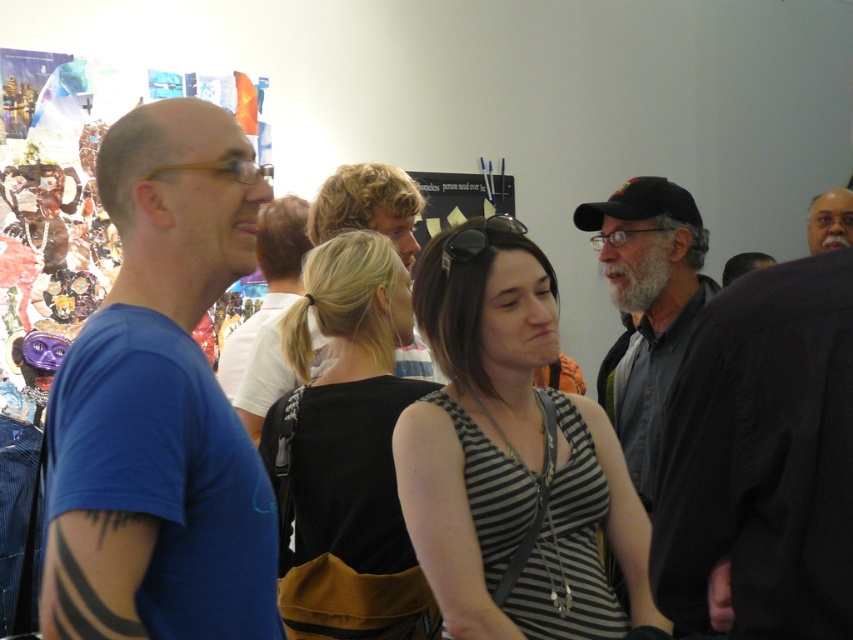
Question: Is black fabric at center positioned behind gray fabric shirt at center?

Choices:
 (A) no
 (B) yes

Answer: (A)

Question: Can you confirm if blue cotton t-shirt at left is positioned to the left of striped fabric tank top at center?

Choices:
 (A) no
 (B) yes

Answer: (B)

Question: Which object is positioned farthest from the gray hair at upper right?

Choices:
 (A) striped fabric tank top at center
 (B) gray fabric shirt at center
 (C) black fabric at center
 (D) blue cotton t-shirt at left

Answer: (D)

Question: Is striped fabric tank top at center in front of black fabric at center?

Choices:
 (A) yes
 (B) no

Answer: (A)

Question: Which point is closer to the camera taking this photo?

Choices:
 (A) (393, 291)
 (B) (666, 291)
 (C) (819, 221)
 (D) (491, 490)

Answer: (D)

Question: Which point is closer to the camera?

Choices:
 (A) gray hair at upper right
 (B) gray fabric shirt at center
 (C) blue cotton t-shirt at left

Answer: (C)